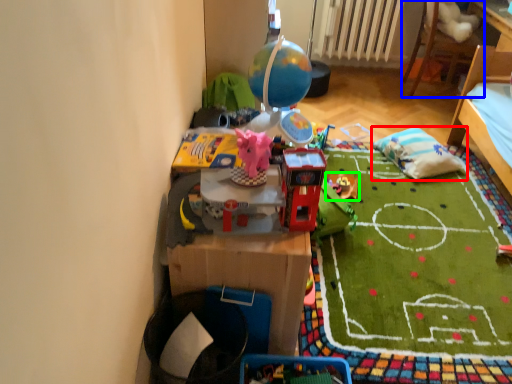
Question: Estimate the real-world distances between objects in this image. Which object is closer to pillow (highlighted by a red box), furniture (highlighted by a blue box) or toy (highlighted by a green box)?

Choices:
 (A) furniture
 (B) toy

Answer: (B)